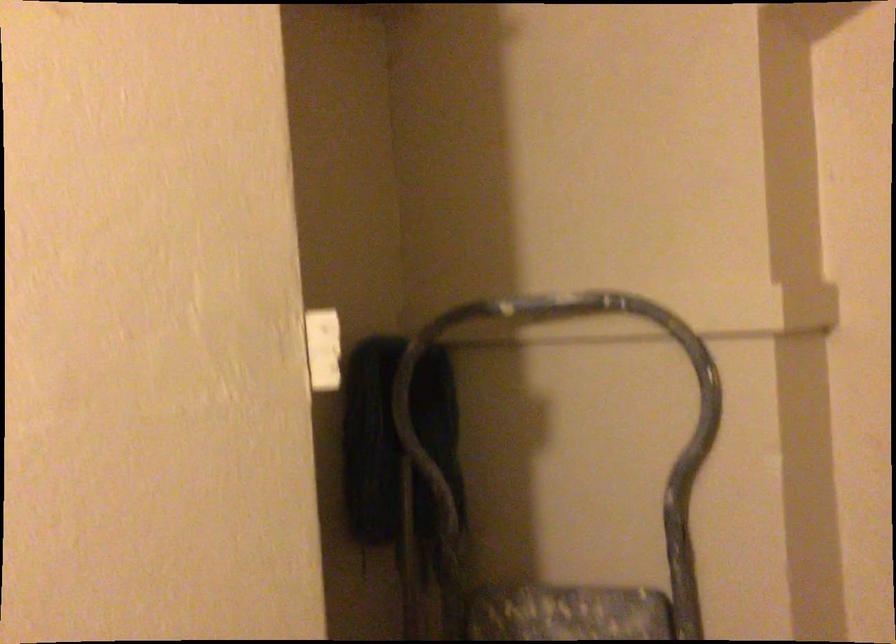
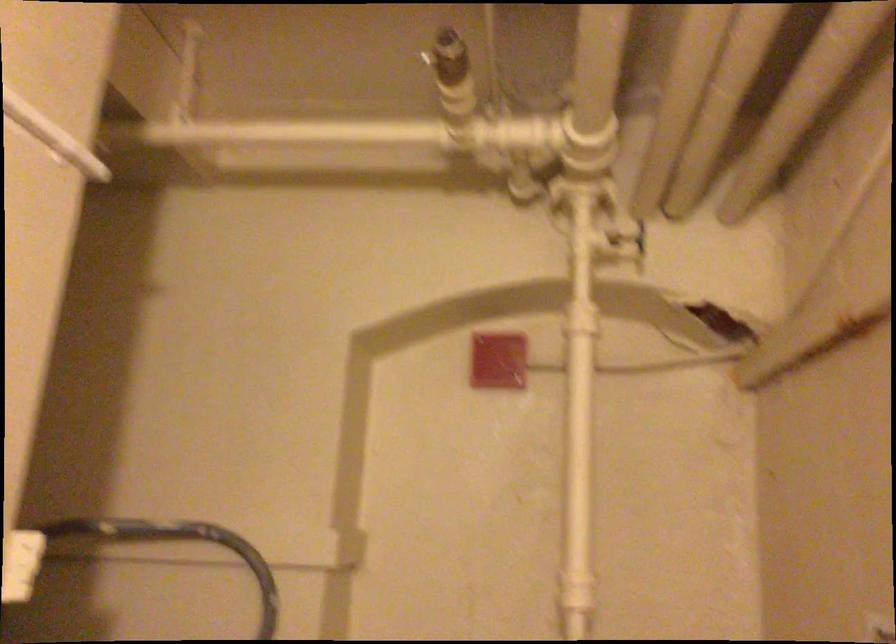
Based on the continuous images, in which direction is the camera rotating?

The camera rotated toward right-up.